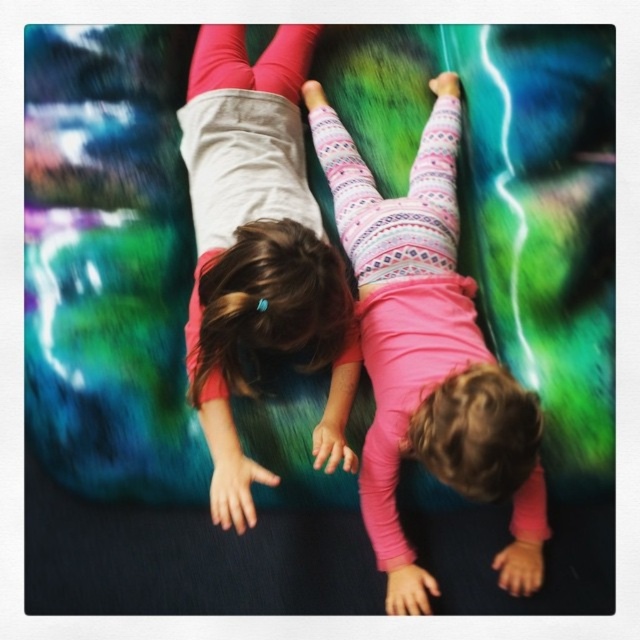
Does pink textured leggings at center have a lesser width compared to pink matte leggings at upper center?

No.

What do you see at coordinates (428, 355) in the screenshot? I see `pink textured leggings at center` at bounding box center [428, 355].

Locate an element on the screen. pink textured leggings at center is located at coordinates (428, 355).